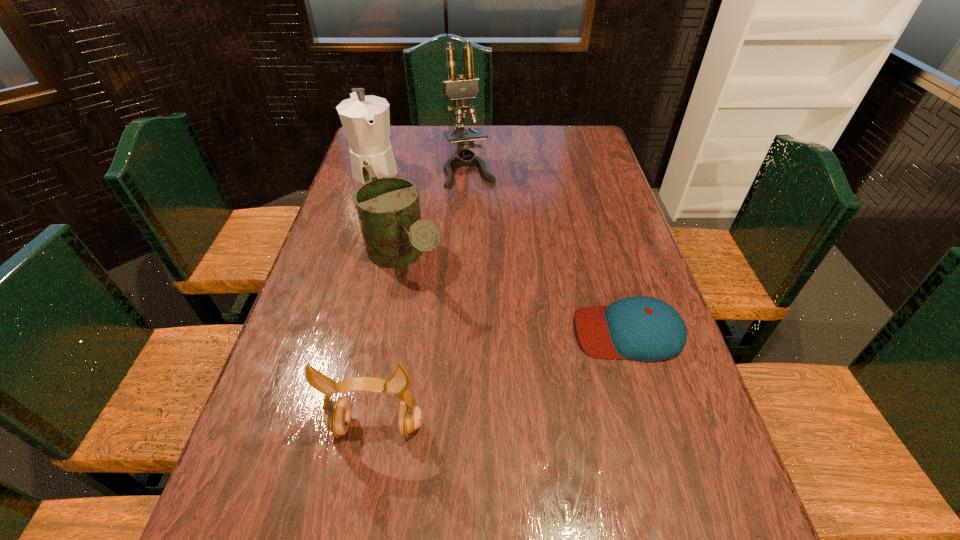
Where is `earphone present at the left edge`? This screenshot has width=960, height=540. earphone present at the left edge is located at coordinates (337, 417).

Where is `watering can present at the left edge`? The image size is (960, 540). watering can present at the left edge is located at coordinates (388, 208).

Identify the location of coffeepot that is positioned at the left edge. (366, 119).

The width and height of the screenshot is (960, 540). Find the location of `object that is positioned at the right edge`. object that is positioned at the right edge is located at coordinates (643, 328).

Where is `object that is at the far left corner`? object that is at the far left corner is located at coordinates (366, 119).

The height and width of the screenshot is (540, 960). In the image, there is a desktop. What are the coordinates of `vacant space at the near edge` in the screenshot? It's located at (360, 491).

This screenshot has width=960, height=540. Identify the location of vacant space at the left edge of the desktop. (358, 234).

At what (x,y) coordinates should I click in order to perform the action: click on vacant region at the right edge of the desktop. Please return your answer as a coordinate pair (x, y). The height and width of the screenshot is (540, 960). Looking at the image, I should click on (679, 447).

This screenshot has width=960, height=540. What are the coordinates of `vacant space at the far right corner` in the screenshot? It's located at (585, 153).

At what (x,y) coordinates should I click in order to perform the action: click on free spot between the nearest object and the watering can. Please return your answer as a coordinate pair (x, y). This screenshot has width=960, height=540. Looking at the image, I should click on (391, 342).